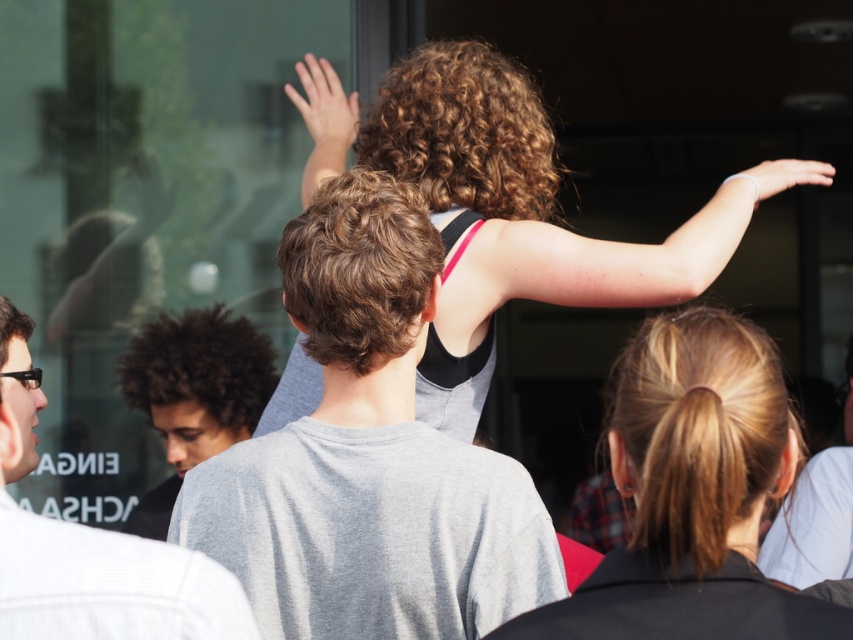
Does dark brown curly hair at lower left lie in front of white matte hand at upper right?

No, dark brown curly hair at lower left is behind white matte hand at upper right.

Between dark brown curly hair at lower left and white matte hand at upper right, which one appears on the right side from the viewer's perspective?

white matte hand at upper right

This screenshot has height=640, width=853. Find the location of `dark brown curly hair at lower left`. dark brown curly hair at lower left is located at coordinates (194, 394).

You are a GUI agent. You are given a task and a screenshot of the screen. Output one action in this format:
    pyautogui.click(x=<x>, y=<y>)
    Task: Click on the dark brown curly hair at lower left
    
    Given the screenshot: What is the action you would take?
    pyautogui.click(x=194, y=394)

Does blonde hair at center appear over light gray t-shirt at center?

Yes.

Is point (666, 609) positioned in front of point (848, 390)?

Yes.

Is point (584, 612) closer to camera compared to point (791, 502)?

Yes, point (584, 612) is in front of point (791, 502).

The width and height of the screenshot is (853, 640). What are the coordinates of `blonde hair at center` in the screenshot? It's located at (692, 493).

Does smooth skin arm at upper right appear over dark brown curly hair at lower left?

Yes, smooth skin arm at upper right is above dark brown curly hair at lower left.

Between point (666, 292) and point (169, 332), which one is positioned behind?

Point (169, 332)

Image resolution: width=853 pixels, height=640 pixels. Identify the location of smooth skin arm at upper right. (637, 248).